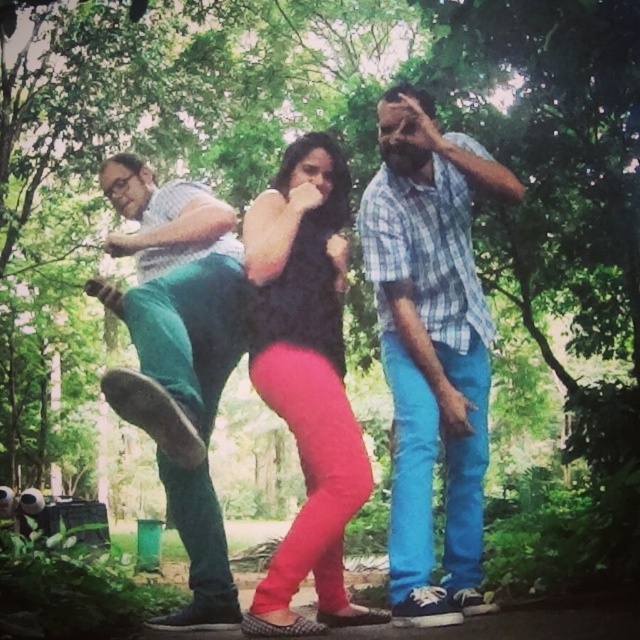
Question: Can you confirm if blue plaid shirt at center is positioned below matte green pants at left?

Choices:
 (A) no
 (B) yes

Answer: (A)

Question: Is blue plaid shirt at center above black matte dress at center?

Choices:
 (A) yes
 (B) no

Answer: (A)

Question: Among these objects, which one is farthest from the camera?

Choices:
 (A) matte green pants at left
 (B) black matte dress at center

Answer: (B)

Question: Which point appears closest to the camera in this image?

Choices:
 (A) (221, 372)
 (B) (307, 157)
 (C) (445, 461)

Answer: (B)

Question: Which of the following is the farthest from the observer?

Choices:
 (A) (269, 394)
 (B) (417, 429)
 (C) (216, 605)

Answer: (C)

Question: Does blue plaid shirt at center appear on the right side of matte green pants at left?

Choices:
 (A) no
 (B) yes

Answer: (B)